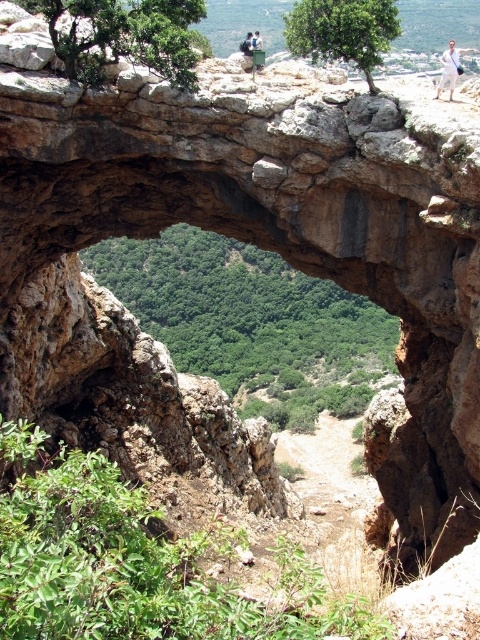
You are standing at the base of the rock formation and looking up. Which object is positioned to the right of the other between the green leafy tree at upper center and the light brown leather jacket at upper center?

The green leafy tree at upper center is positioned to the right of the light brown leather jacket at upper center.

You are standing at the base of the rock formation and want to take a photo of the green leafy tree at upper left and the light brown leather jacket at upper center. Which object will appear larger in the photo?

The green leafy tree at upper left will appear larger in the photo because it is closer to the viewer than the light brown leather jacket at upper center.

You are a hiker standing at the base of the rock formation. You notice a green leafy tree at upper center and a light brown leather jacket at upper center. Which object is closer to you from your vantage point?

The green leafy tree at upper center is closer to you because it is in front of the light brown leather jacket at upper center.